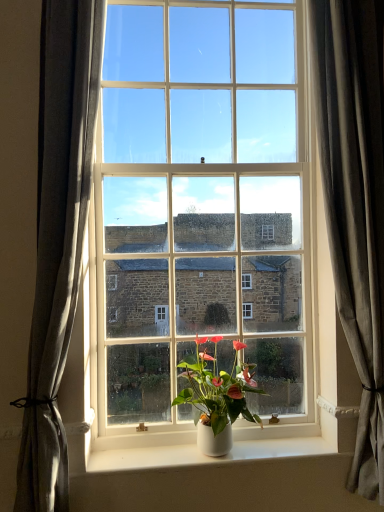
Question: Can you confirm if gray fabric curtain at left, the first curtain positioned from the left, is shorter than white matte window sill at center?

Choices:
 (A) no
 (B) yes

Answer: (A)

Question: Is gray fabric curtain at left, the first curtain positioned from the left, not within white matte window sill at center?

Choices:
 (A) no
 (B) yes

Answer: (B)

Question: Is gray fabric curtain at left, the second curtain in the right-to-left sequence, to the left of white matte window sill at center from the viewer's perspective?

Choices:
 (A) no
 (B) yes

Answer: (B)

Question: Considering the relative sizes of gray fabric curtain at left, the first curtain positioned from the left, and white matte window sill at center in the image provided, is gray fabric curtain at left, the first curtain positioned from the left, thinner than white matte window sill at center?

Choices:
 (A) yes
 (B) no

Answer: (B)

Question: Is gray fabric curtain at left, the second curtain in the right-to-left sequence, surrounding white matte window sill at center?

Choices:
 (A) yes
 (B) no

Answer: (B)

Question: In the image, is white glossy pot at center positioned in front of or behind gray fabric curtain at left, the second curtain in the right-to-left sequence?

Choices:
 (A) behind
 (B) front

Answer: (A)

Question: Would you say white glossy pot at center is to the left or to the right of gray fabric curtain at left, the first curtain positioned from the left, in the picture?

Choices:
 (A) right
 (B) left

Answer: (A)

Question: Choose the correct answer: Is white glossy pot at center inside gray fabric curtain at left, the second curtain in the right-to-left sequence, or outside it?

Choices:
 (A) inside
 (B) outside

Answer: (B)

Question: From their relative heights in the image, would you say white glossy pot at center is taller or shorter than gray fabric curtain at left, the first curtain positioned from the left?

Choices:
 (A) tall
 (B) short

Answer: (B)

Question: Would you say gray fabric curtain at right, which appears as the 1th curtain when viewed from the right, is inside or outside white matte window sill at center?

Choices:
 (A) inside
 (B) outside

Answer: (B)

Question: In terms of width, does gray fabric curtain at right, which appears as the 1th curtain when viewed from the right, look wider or thinner when compared to white matte window sill at center?

Choices:
 (A) thin
 (B) wide

Answer: (B)

Question: Is point (334, 282) closer or farther from the camera than point (114, 461)?

Choices:
 (A) closer
 (B) farther

Answer: (B)

Question: From a real-world perspective, is gray fabric curtain at right, which appears as the 1th curtain when viewed from the right, above or below white matte window sill at center?

Choices:
 (A) below
 (B) above

Answer: (B)

Question: Does point (228, 35) appear closer or farther from the camera than point (213, 432)?

Choices:
 (A) farther
 (B) closer

Answer: (A)

Question: Looking at the image, does white glossy window at center seem bigger or smaller compared to white glossy pot at center?

Choices:
 (A) small
 (B) big

Answer: (B)